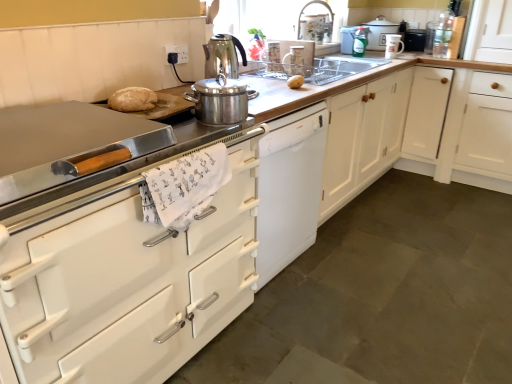
Question: In terms of height, does metallic faucet at upper center look taller or shorter compared to white wood cabinet at right, which appears as the 2th cabinetry when viewed from the front?

Choices:
 (A) tall
 (B) short

Answer: (B)

Question: From a real-world perspective, is metallic faucet at upper center physically located above or below white wood cabinet at right, which appears as the 2th cabinetry when viewed from the front?

Choices:
 (A) below
 (B) above

Answer: (B)

Question: Considering the real-world distances, which object is farthest from the black matte microwave at upper right, the first appliance positioned from the back?

Choices:
 (A) metallic silver toaster at upper right, placed as the second appliance when sorted from back to front
 (B) clear glass sink at center
 (C) stainless steel pot at center, the 5th kitchen appliance from the right
 (D) white ceramic mug at upper right, the fifth kitchen appliance in the left-to-right sequence
 (E) yellow matte potato at center

Answer: (C)

Question: Considering the real-world distances, which object is closest to the green glossy spray bottle at upper center, arranged as the fourth kitchen appliance when viewed from the left?

Choices:
 (A) yellow matte potato at center
 (B) stainless steel pot at center, which ranks as the 1th kitchen appliance in front-to-back order
 (C) white wood cabinet at right, which appears as the 2th cabinetry when viewed from the front
 (D) metallic faucet at upper center
 (E) white ceramic mug at upper right, the 3th kitchen appliance from the back

Answer: (E)